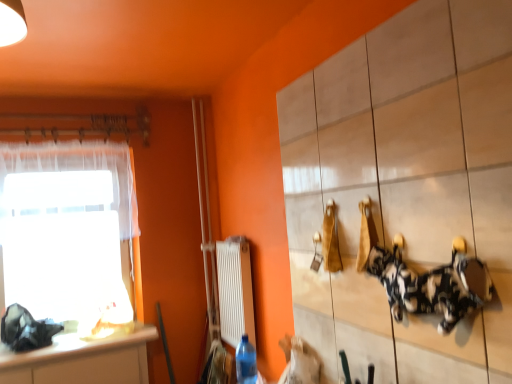
Question: Considering the positions of white tile cabinet at upper right and white glossy countertop at lower left in the image, is white tile cabinet at upper right taller or shorter than white glossy countertop at lower left?

Choices:
 (A) short
 (B) tall

Answer: (B)

Question: Is white tile cabinet at upper right spatially inside white glossy countertop at lower left, or outside of it?

Choices:
 (A) outside
 (B) inside

Answer: (A)

Question: Which is farther from the white plastic radiator at center?

Choices:
 (A) white sheer curtain at left
 (B) blue plastic bottle at lower center
 (C) transparent fabric at left
 (D) white glossy countertop at lower left
 (E) white tile cabinet at upper right

Answer: (E)

Question: Which object is the farthest from the white tile cabinet at upper right?

Choices:
 (A) white glossy countertop at lower left
 (B) white sheer curtain at left
 (C) transparent fabric at left
 (D) white plastic radiator at center
 (E) blue plastic bottle at lower center

Answer: (C)